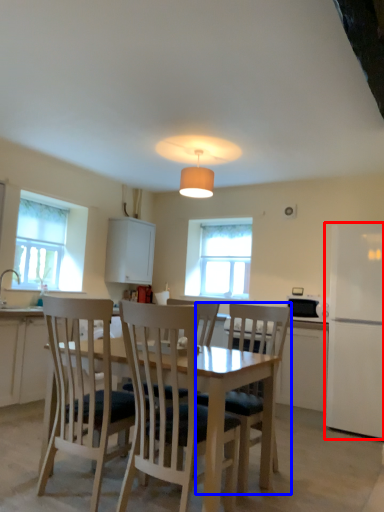
Question: Among these objects, which one is farthest to the camera, fridge (highlighted by a red box) or chair (highlighted by a blue box)?

Choices:
 (A) fridge
 (B) chair

Answer: (A)